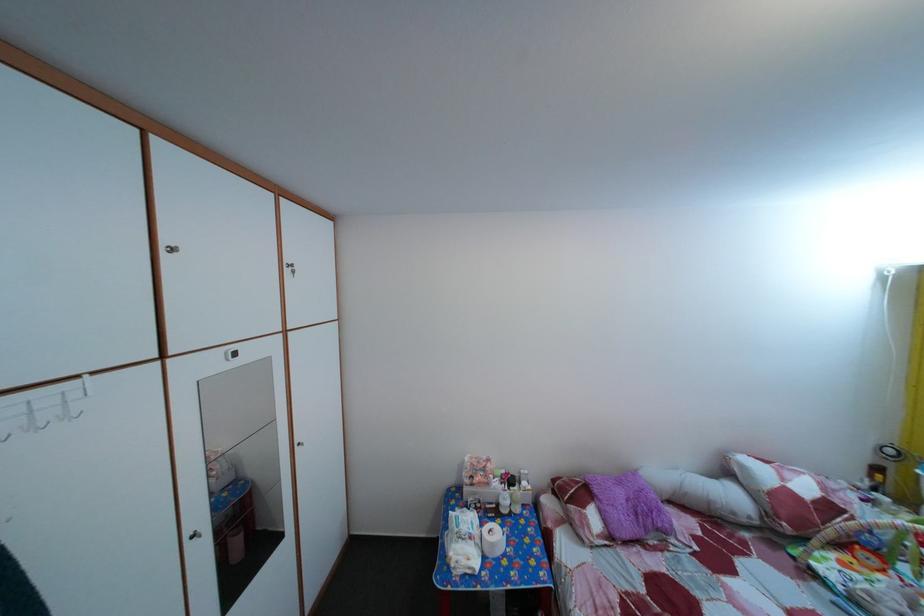
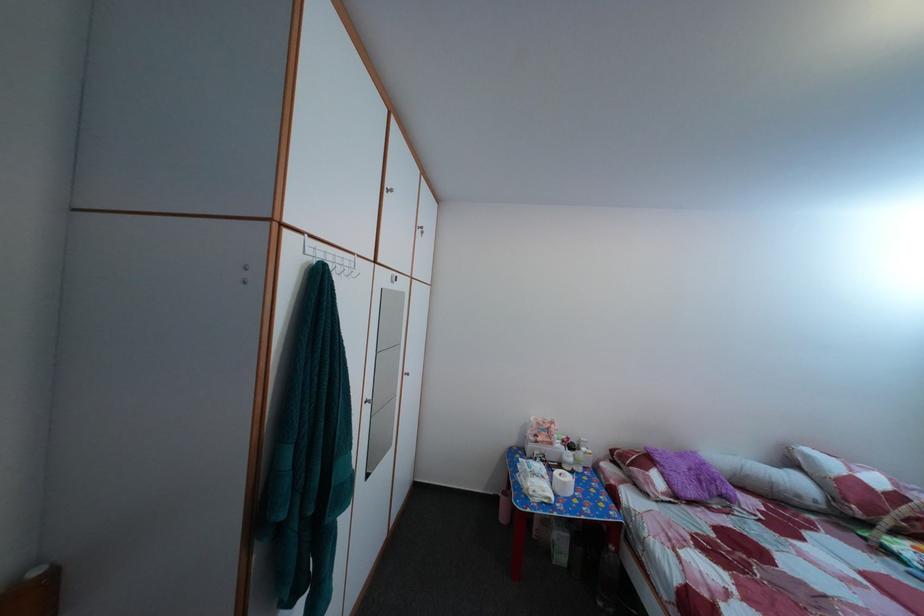
Question: Based on the continuous images, in which direction is the camera rotating? Reply with the corresponding letter.

Choices:
 (A) Left
 (B) Right
 (C) Up
 (D) Down

Answer: (C)